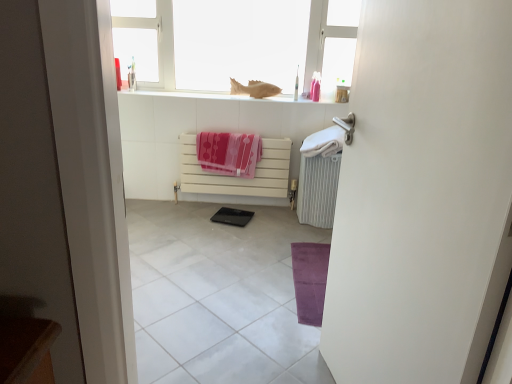
Question: From their relative heights in the image, would you say black glossy pad at center is taller or shorter than pink fabric beach towel at center, which is counted as the first beach towel, starting from the left?

Choices:
 (A) short
 (B) tall

Answer: (A)

Question: In the image, is black glossy pad at center on the left side or the right side of pink fabric beach towel at center, the 2th beach towel positioned from the right?

Choices:
 (A) right
 (B) left

Answer: (A)

Question: Estimate the real-world distances between objects in this image. Which object is closer to the matte beige fish at upper center?

Choices:
 (A) white matte window sill at upper center
 (B) white soft towel at right, the first beach towel viewed from the right
 (C) black glossy pad at center
 (D) white metallic radiator at right
 (E) white matte radiator at center

Answer: (A)

Question: Which object is the farthest from the pink fabric beach towel at center, the 2th beach towel positioned from the right?

Choices:
 (A) white matte radiator at center
 (B) white glossy window at upper center
 (C) purple velvety yoga mat at lower right
 (D) white glossy tile at center
 (E) white plastic toothbrush at upper center

Answer: (C)